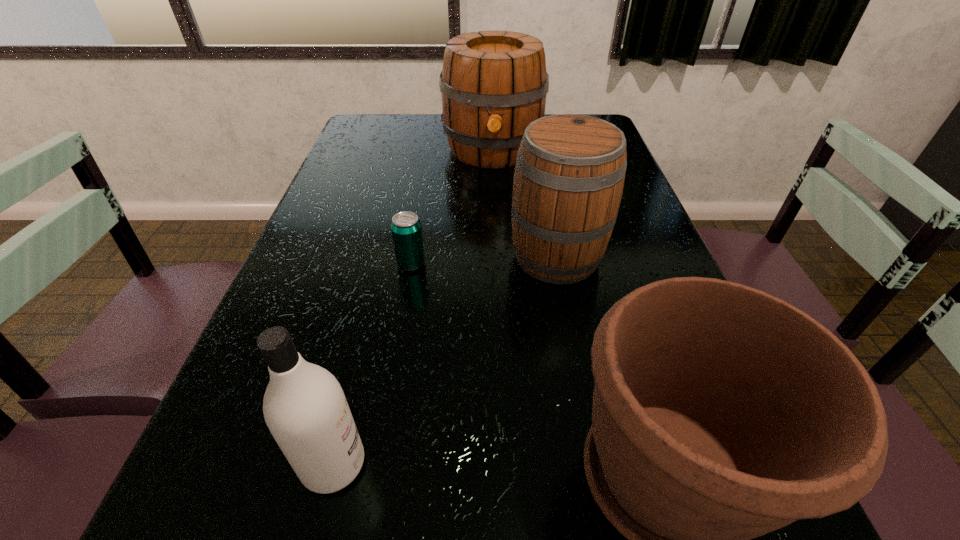
The height and width of the screenshot is (540, 960). Identify the location of the farther cider. (493, 83).

You are a GUI agent. You are given a task and a screenshot of the screen. Output one action in this format:
    pyautogui.click(x=<x>, y=<y>)
    Task: Click on the nearer cider
    
    Given the screenshot: What is the action you would take?
    pyautogui.click(x=570, y=169)

This screenshot has width=960, height=540. In order to click on shampoo in this screenshot , I will do `click(304, 406)`.

Locate an element on the screen. Image resolution: width=960 pixels, height=540 pixels. beer can is located at coordinates (406, 229).

You are a GUI agent. You are given a task and a screenshot of the screen. Output one action in this format:
    pyautogui.click(x=<x>, y=<y>)
    Task: Click on the vacant space located 0.340m on the side of the farther cider where the spigot is located
    
    Given the screenshot: What is the action you would take?
    pyautogui.click(x=497, y=251)

You are a GUI agent. You are given a task and a screenshot of the screen. Output one action in this format:
    pyautogui.click(x=<x>, y=<y>)
    Task: Click on the vacant point located 0.330m on the front of the nearer cider
    This screenshot has height=540, width=960.
    Given the screenshot: What is the action you would take?
    pyautogui.click(x=591, y=436)

I want to click on vacant space situated 0.400m on the front-facing side of the shampoo, so click(x=630, y=464).

This screenshot has width=960, height=540. What are the coordinates of `vacant space located on the front of the beer can` in the screenshot? It's located at (402, 317).

What are the coordinates of `object positioned at the far edge` in the screenshot? It's located at (493, 83).

Locate an element on the screen. object that is at the left edge is located at coordinates (304, 406).